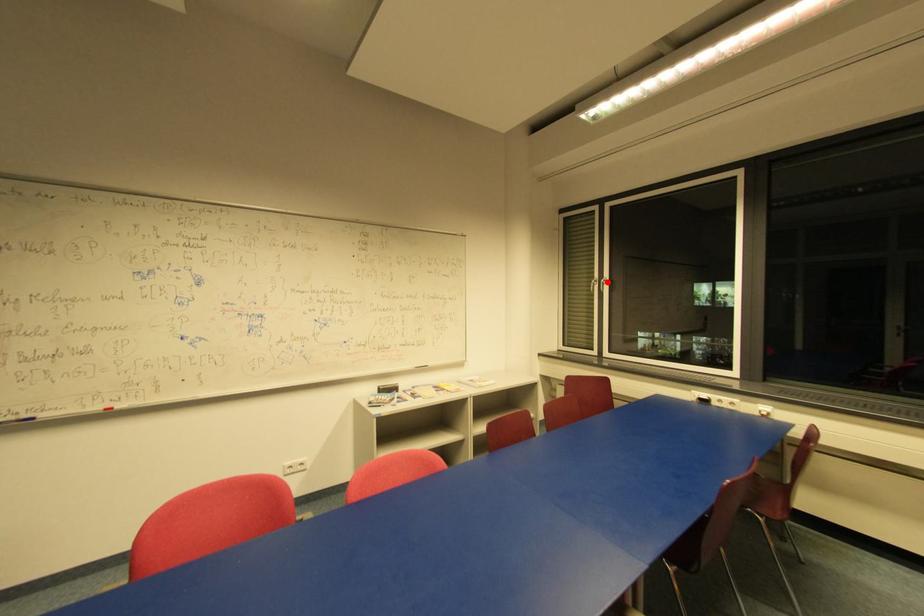
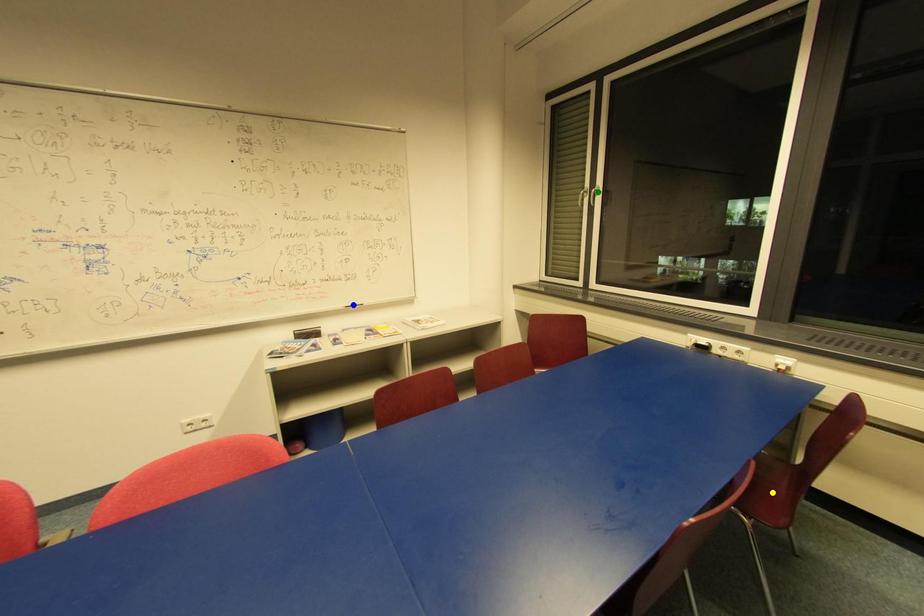
Question: I am providing you with two images of the same scene from different viewpoints. A red point is marked on the first image. You are given multiple points on the second image. Can you choose the point in image 2 that corresponds to the point in image 1?

Choices:
 (A) green point
 (B) yellow point
 (C) blue point

Answer: (A)